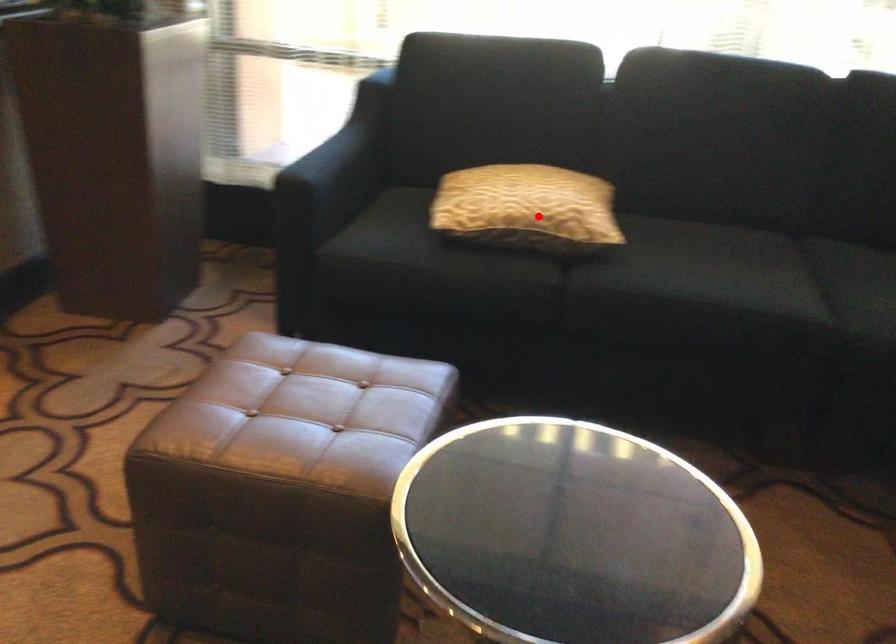
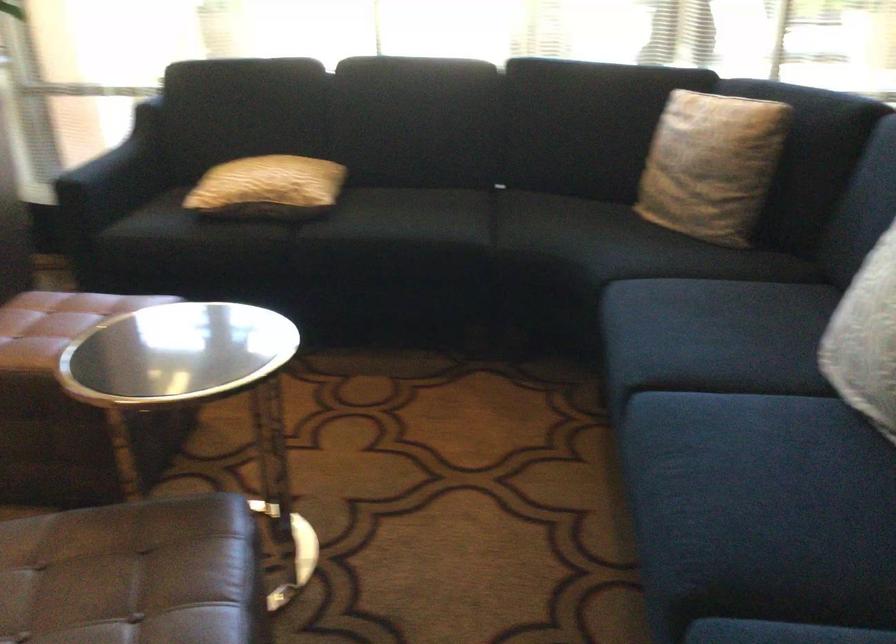
Question: I am providing you with two images of the same scene from different viewpoints. A red point is shown in image1. For the corresponding object point in image2, is it positioned nearer or farther from the camera?

Choices:
 (A) Nearer
 (B) Farther

Answer: (B)